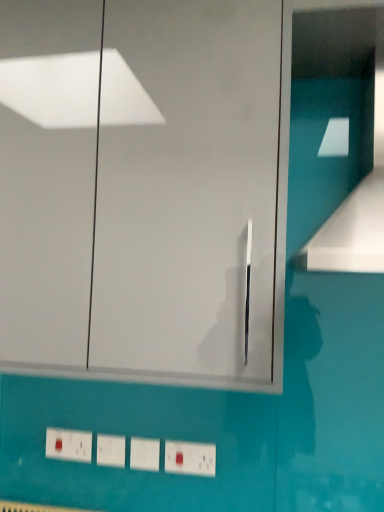
Question: Should I look upward or downward to see white plastic switch at lower center?

Choices:
 (A) down
 (B) up

Answer: (A)

Question: Is matte white electric outlet at lower left a part of white glossy vent at upper right?

Choices:
 (A) yes
 (B) no

Answer: (B)

Question: Can you confirm if white glossy vent at upper right is smaller than matte white electric outlet at lower left?

Choices:
 (A) no
 (B) yes

Answer: (A)

Question: From a real-world perspective, is white glossy vent at upper right beneath matte white electric outlet at lower left?

Choices:
 (A) yes
 (B) no

Answer: (B)

Question: Does white glossy vent at upper right have a lesser height compared to matte white electric outlet at lower left?

Choices:
 (A) yes
 (B) no

Answer: (B)

Question: Can you confirm if white glossy vent at upper right is taller than matte white electric outlet at lower left?

Choices:
 (A) no
 (B) yes

Answer: (B)

Question: From a real-world perspective, is white glossy vent at upper right located higher than matte white electric outlet at lower left?

Choices:
 (A) yes
 (B) no

Answer: (A)

Question: Does matte white electric outlet at lower left have a lesser width compared to white plastic switch at lower center?

Choices:
 (A) no
 (B) yes

Answer: (A)

Question: Considering the relative sizes of matte white electric outlet at lower left and white plastic switch at lower center in the image provided, is matte white electric outlet at lower left bigger than white plastic switch at lower center?

Choices:
 (A) yes
 (B) no

Answer: (A)

Question: From the image's perspective, is matte white electric outlet at lower left beneath white plastic switch at lower center?

Choices:
 (A) yes
 (B) no

Answer: (B)

Question: Considering the relative sizes of matte white electric outlet at lower left and white plastic switch at lower center in the image provided, is matte white electric outlet at lower left wider than white plastic switch at lower center?

Choices:
 (A) no
 (B) yes

Answer: (B)

Question: Is matte white electric outlet at lower left facing away from white plastic switch at lower center?

Choices:
 (A) yes
 (B) no

Answer: (B)

Question: Can you see matte white electric outlet at lower left touching white plastic switch at lower center?

Choices:
 (A) no
 (B) yes

Answer: (A)

Question: Is matte white electric outlet at lower left wider than white plastic light switch at lower center?

Choices:
 (A) no
 (B) yes

Answer: (B)